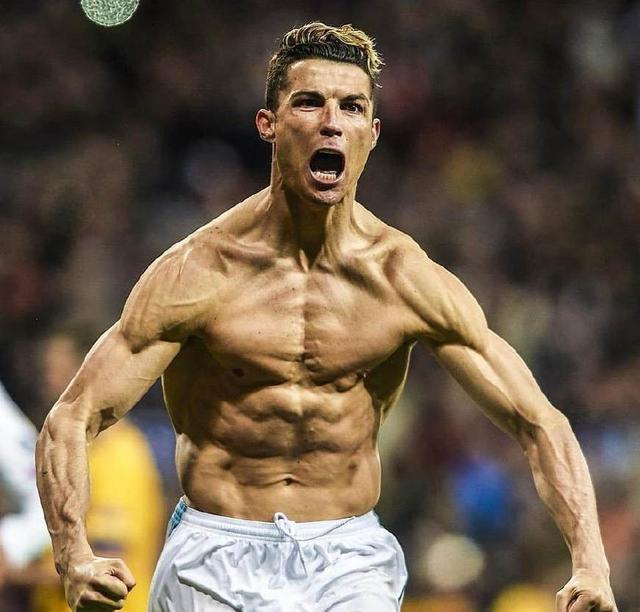
The width and height of the screenshot is (640, 612). I want to click on chest, so click(x=301, y=318).